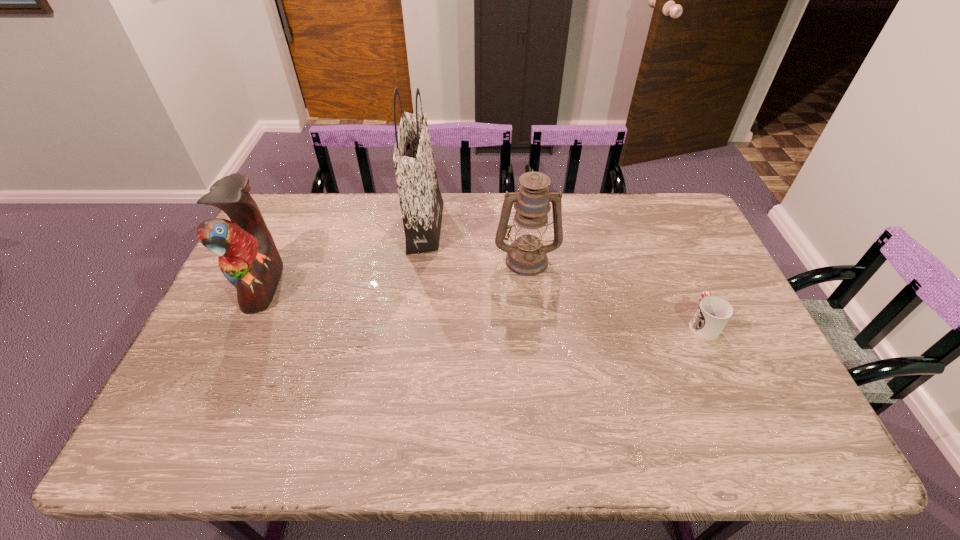
This screenshot has height=540, width=960. In order to click on free point that satisfies the following two spatial constraints: 1. on the front of the second object from right to left with the design; 2. on the right side of the tallest object in this screenshot , I will do `click(420, 259)`.

The height and width of the screenshot is (540, 960). What are the coordinates of `vacant space that satisfies the following two spatial constraints: 1. on the handle side of the rightmost object; 2. at the face of the leftmost object` in the screenshot? It's located at (685, 285).

Locate an element on the screen. The height and width of the screenshot is (540, 960). free region that satisfies the following two spatial constraints: 1. on the front of the tallest object with the design; 2. on the back side of the third object from left to right is located at coordinates (420, 259).